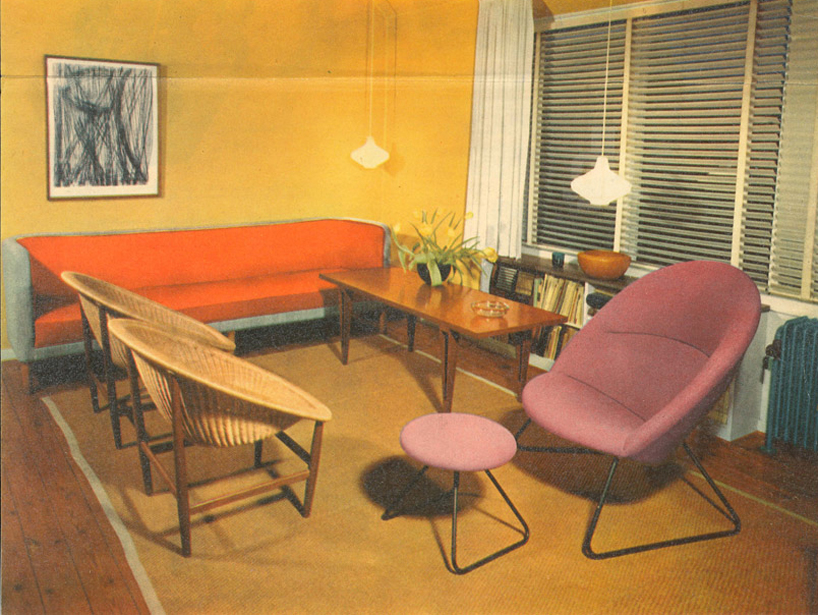
Find the location of a particular element. The height and width of the screenshot is (615, 818). table pot plant is located at coordinates (429, 270).